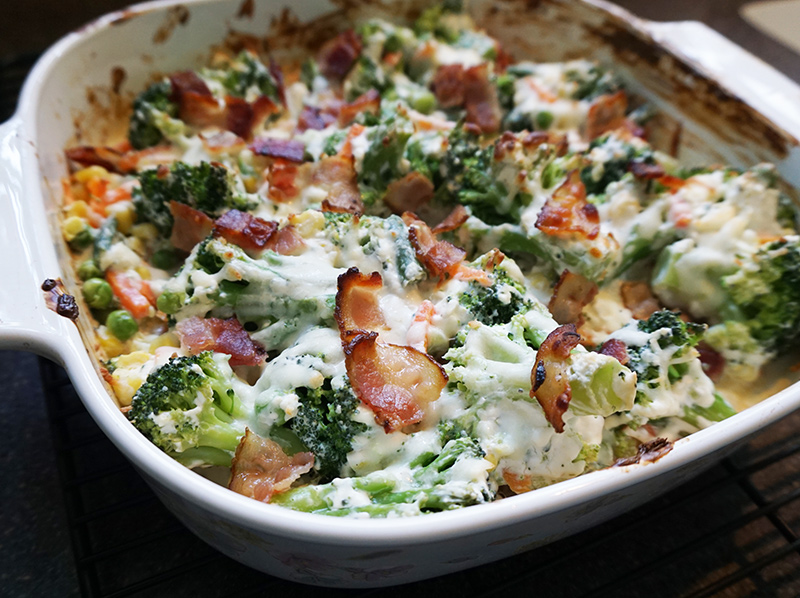
Generate point markers for all where you'd hold the casserole dish in the image. Your answer should be formatted as a list of tuples, i.e. [(x1, y1), (x2, y2), ...], where each tuple contains the x and y coordinates of a point satisfying the conditions above.

[(10, 277), (730, 57)]